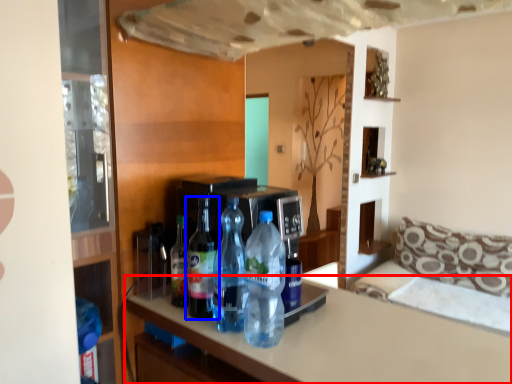
Question: Which object is closer to the camera taking this photo, countertop (highlighted by a red box) or bottle (highlighted by a blue box)?

Choices:
 (A) countertop
 (B) bottle

Answer: (A)